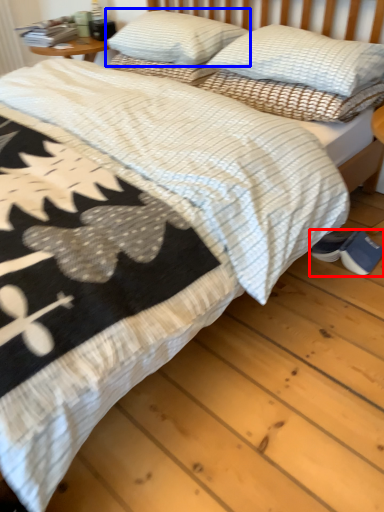
Question: Which object appears closest to the camera in this image, footwear (highlighted by a red box) or pillow (highlighted by a blue box)?

Choices:
 (A) footwear
 (B) pillow

Answer: (A)